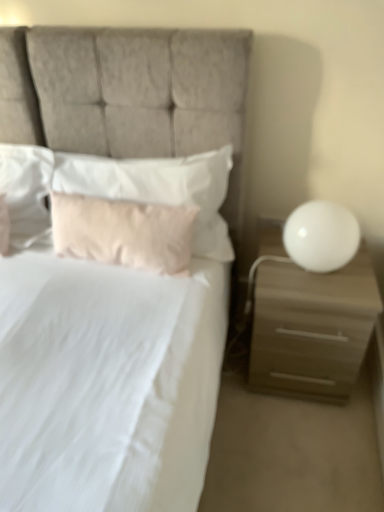
Question: Is white soft pillow at upper left, which is the 3th pillow from right to left, to the right of soft pink pillow at center, which is the 3th pillow in left-to-right order, from the viewer's perspective?

Choices:
 (A) yes
 (B) no

Answer: (B)

Question: Can you confirm if white soft pillow at upper left, which is the 3th pillow from right to left, is taller than soft pink pillow at center, which is the 3th pillow in left-to-right order?

Choices:
 (A) yes
 (B) no

Answer: (B)

Question: Would you say soft pink pillow at center, which is the 3th pillow in left-to-right order, is part of white soft pillow at upper left, which is the 3th pillow from right to left,'s contents?

Choices:
 (A) no
 (B) yes

Answer: (A)

Question: From a real-world perspective, is white soft pillow at upper left, placed as the first pillow when sorted from left to right, located higher than soft pink pillow at center, which is the 3th pillow in left-to-right order?

Choices:
 (A) no
 (B) yes

Answer: (A)

Question: Considering the relative sizes of white soft pillow at upper left, placed as the first pillow when sorted from left to right, and soft pink pillow at center, which is the 3th pillow in left-to-right order, in the image provided, is white soft pillow at upper left, placed as the first pillow when sorted from left to right, wider than soft pink pillow at center, which is the 3th pillow in left-to-right order,?

Choices:
 (A) no
 (B) yes

Answer: (B)

Question: Can you confirm if white soft pillow at upper left, which is the 3th pillow from right to left, is positioned to the left of soft pink pillow at center, arranged as the 1th pillow when viewed from the right?

Choices:
 (A) no
 (B) yes

Answer: (B)

Question: Could you tell me if pink fabric pillow at center, which is the 2th pillow in left-to-right order, is facing soft pink pillow at center, arranged as the 1th pillow when viewed from the right?

Choices:
 (A) no
 (B) yes

Answer: (A)

Question: Can soft pink pillow at center, arranged as the 1th pillow when viewed from the right, be found inside pink fabric pillow at center, acting as the second pillow starting from the right?

Choices:
 (A) yes
 (B) no

Answer: (B)

Question: From a real-world perspective, is pink fabric pillow at center, acting as the second pillow starting from the right, physically above soft pink pillow at center, arranged as the 1th pillow when viewed from the right?

Choices:
 (A) no
 (B) yes

Answer: (A)

Question: Is pink fabric pillow at center, which is the 2th pillow in left-to-right order, far away from soft pink pillow at center, which is the 3th pillow in left-to-right order?

Choices:
 (A) no
 (B) yes

Answer: (A)

Question: Does pink fabric pillow at center, acting as the second pillow starting from the right, have a greater width compared to soft pink pillow at center, arranged as the 1th pillow when viewed from the right?

Choices:
 (A) no
 (B) yes

Answer: (A)

Question: Can you confirm if pink fabric pillow at center, acting as the second pillow starting from the right, is shorter than soft pink pillow at center, arranged as the 1th pillow when viewed from the right?

Choices:
 (A) yes
 (B) no

Answer: (A)

Question: Considering the relative sizes of white soft pillow at upper left, placed as the first pillow when sorted from left to right, and white glossy sphere at right in the image provided, is white soft pillow at upper left, placed as the first pillow when sorted from left to right, bigger than white glossy sphere at right?

Choices:
 (A) yes
 (B) no

Answer: (A)